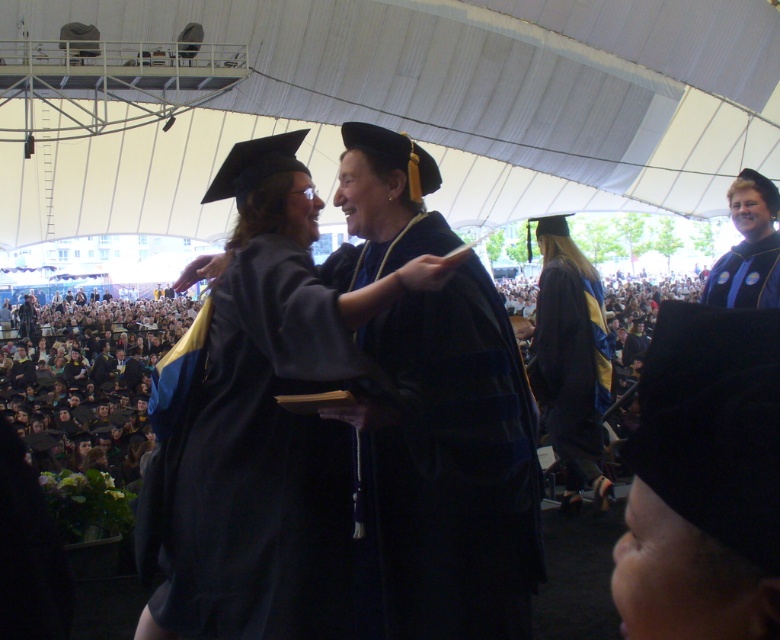
Question: Can you confirm if velvety black gown at center is thinner than matte black graduation gown at center?

Choices:
 (A) no
 (B) yes

Answer: (A)

Question: Estimate the real-world distances between objects in this image. Which object is closer to the velvety black gown at center?

Choices:
 (A) black matte graduation cap at lower right
 (B) matte black graduation gown at upper right

Answer: (A)

Question: Is matte black gown at center positioned in front of velvety black gown at center?

Choices:
 (A) yes
 (B) no

Answer: (A)

Question: Which of the following is the farthest from the observer?

Choices:
 (A) (225, 612)
 (B) (663, 394)
 (C) (413, 371)
 (D) (582, 320)

Answer: (D)

Question: Observing the image, what is the correct spatial positioning of matte black gown at center in reference to matte black graduation gown at center?

Choices:
 (A) left
 (B) right

Answer: (A)

Question: Based on their relative distances, which object is nearer to the velvety black gown at center?

Choices:
 (A) matte black gown at center
 (B) matte black graduation gown at upper right
 (C) matte black graduation gown at center
 (D) black matte graduation cap at lower right

Answer: (A)